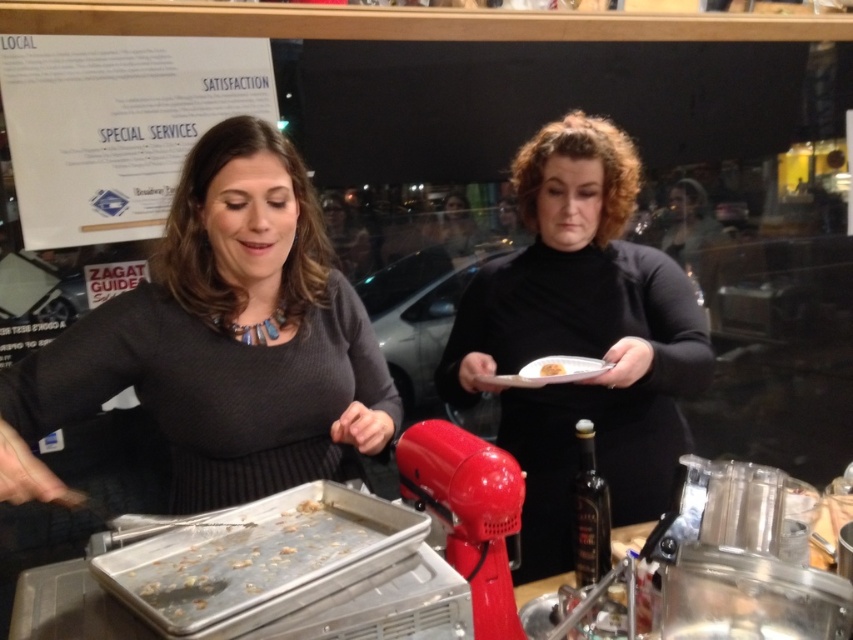
Question: Which point is farther from the camera taking this photo?

Choices:
 (A) (242, 500)
 (B) (566, 156)

Answer: (B)

Question: Estimate the real-world distances between objects in this image. Which object is closer to the dark gray ribbed sweater at center?

Choices:
 (A) black matte dress at center
 (B) yellow matte bread at center

Answer: (A)

Question: Is the position of black matte dress at center more distant than that of yellow matte bread at center?

Choices:
 (A) no
 (B) yes

Answer: (A)

Question: Is black matte dress at center positioned behind yellow matte bread at center?

Choices:
 (A) yes
 (B) no

Answer: (B)

Question: Is dark gray ribbed sweater at center to the left of black matte dress at center from the viewer's perspective?

Choices:
 (A) yes
 (B) no

Answer: (A)

Question: Which point is closer to the camera taking this photo?

Choices:
 (A) (624, 316)
 (B) (543, 364)

Answer: (B)